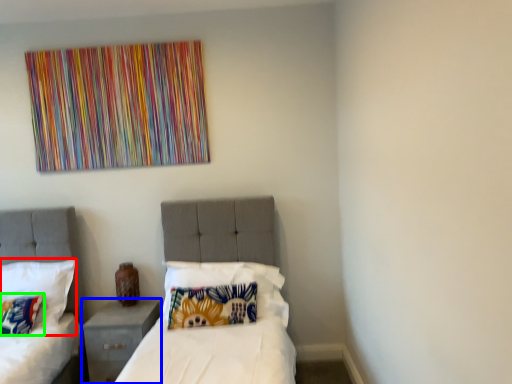
Question: Estimate the real-world distances between objects in this image. Which object is farther from pillow (highlighted by a red box), nightstand (highlighted by a blue box) or pillow (highlighted by a green box)?

Choices:
 (A) nightstand
 (B) pillow

Answer: (A)